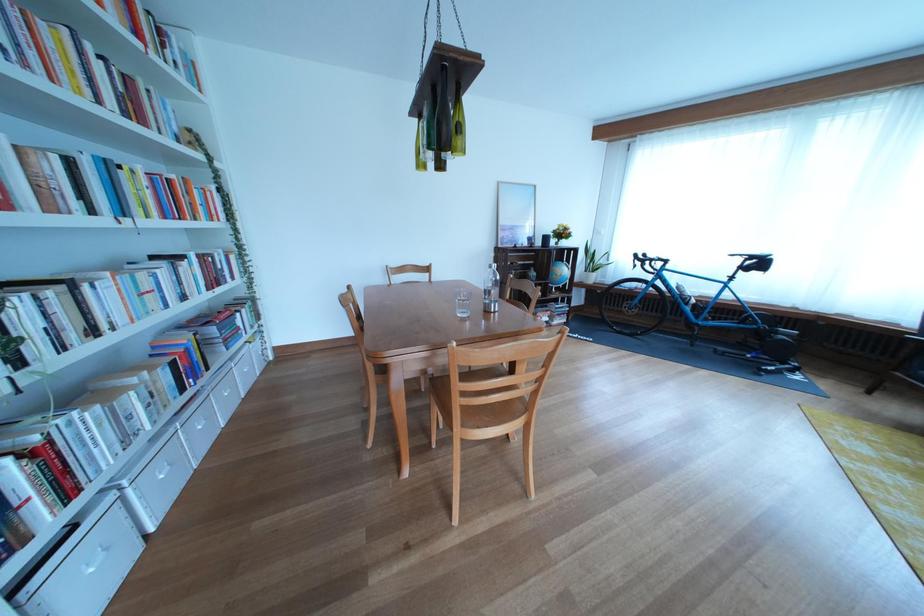
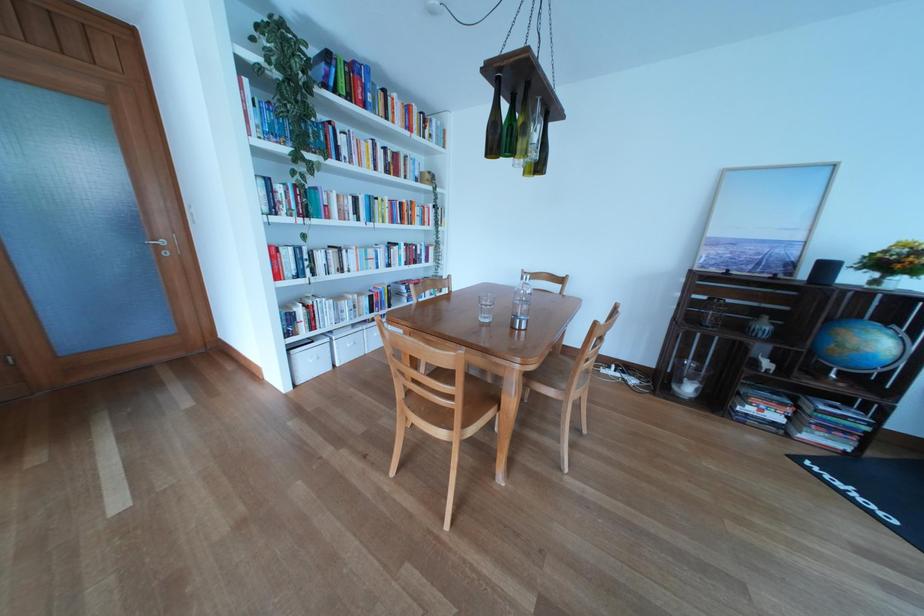
Locate, in the second image, the point that corresponds to point 552,249 in the first image.

(816, 282)